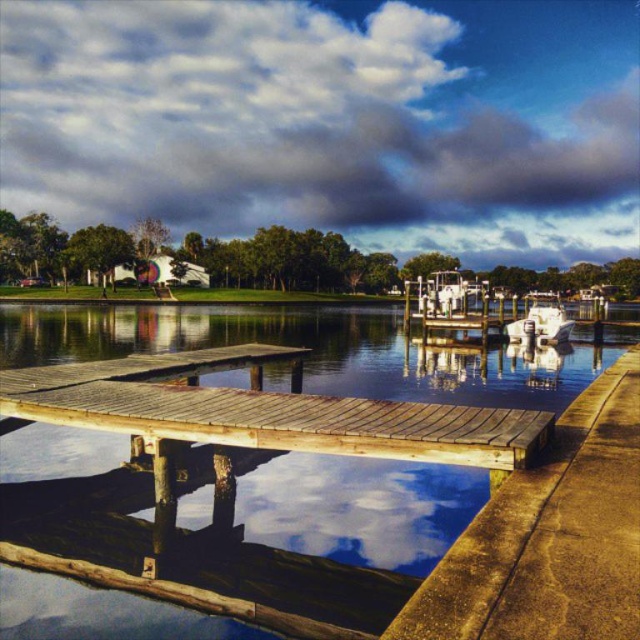
Question: Does smooth wooden dock at center appear on the right side of white glossy boat at right?

Choices:
 (A) yes
 (B) no

Answer: (B)

Question: Is smooth wooden dock at center thinner than weathered wood dock at center?

Choices:
 (A) no
 (B) yes

Answer: (A)

Question: Which point is closer to the camera taking this photo?

Choices:
 (A) (259, 432)
 (B) (557, 340)
 (C) (45, 618)

Answer: (C)

Question: Among these objects, which one is nearest to the camera?

Choices:
 (A) weathered wood dock at center
 (B) smooth wooden dock at center

Answer: (A)

Question: Which of the following is the farthest from the observer?

Choices:
 (A) (17, 438)
 (B) (509, 324)
 (C) (435, 461)

Answer: (B)

Question: Does weathered wood dock at center lie behind white glossy boat at right?

Choices:
 (A) yes
 (B) no

Answer: (B)